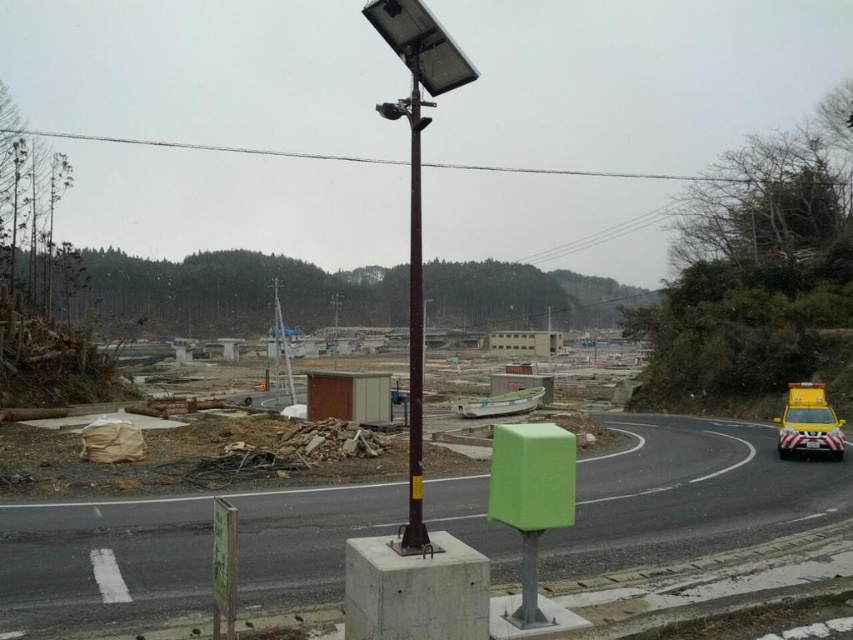
Who is shorter, green plastic box at center or brown metallic pole at center?

Standing shorter between the two is green plastic box at center.

Between green plastic box at center and brown metallic pole at center, which one appears on the left side from the viewer's perspective?

brown metallic pole at center is more to the left.

In order to click on green plastic box at center in this screenshot , I will do `click(689, 493)`.

Can you confirm if green plastic box at center is taller than yellow matte van at right?

In fact, green plastic box at center may be shorter than yellow matte van at right.

Between green plastic box at center and yellow matte van at right, which one has more height?

yellow matte van at right

Which is behind, point (201, 580) or point (784, 429)?

The point (784, 429) is more distant.

The image size is (853, 640). Identify the location of green plastic box at center. (689, 493).

What do you see at coordinates (415, 323) in the screenshot? I see `brown metallic pole at center` at bounding box center [415, 323].

Does brown metallic pole at center come behind yellow matte van at right?

No, brown metallic pole at center is closer to the viewer.

Which is behind, point (407, 106) or point (827, 413)?

The point (827, 413) is more distant.

Where is `brown metallic pole at center`? The width and height of the screenshot is (853, 640). brown metallic pole at center is located at coordinates (415, 323).